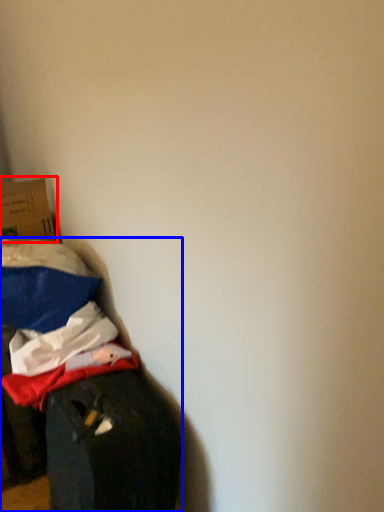
Question: Which object is further to the camera taking this photo, box (highlighted by a red box) or furniture (highlighted by a blue box)?

Choices:
 (A) box
 (B) furniture

Answer: (A)